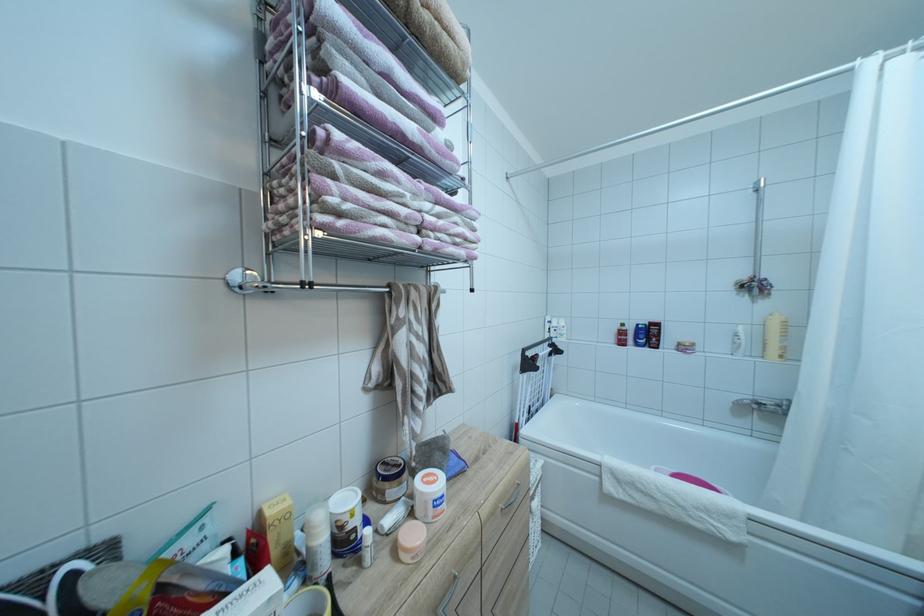
What do you see at coordinates (286, 284) in the screenshot?
I see `the towel rack bar` at bounding box center [286, 284].